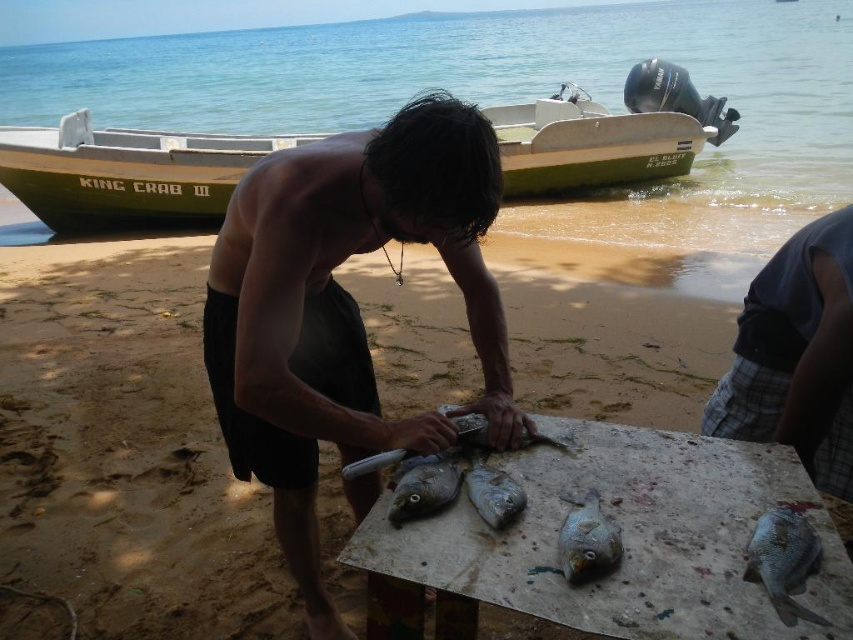
Question: Which point is closer to the camera?

Choices:
 (A) (416, 481)
 (B) (399, 330)
 (C) (654, 72)

Answer: (A)

Question: Can you confirm if gray plaid shorts at lower right is positioned below shiny silver fish at center?

Choices:
 (A) no
 (B) yes

Answer: (A)

Question: Among these objects, which one is nearest to the camera?

Choices:
 (A) gray matte fish at center
 (B) sandy beach at center
 (C) white worn wood table at center

Answer: (C)

Question: Which of these objects is positioned farthest from the white worn wood table at center?

Choices:
 (A) green matte boat at upper center
 (B) dark brown shorts at center
 (C) silvery metallic fish at center
 (D) shiny silver fish at lower right

Answer: (A)

Question: Is sandy beach at center above silvery metallic fish at center?

Choices:
 (A) no
 (B) yes

Answer: (A)

Question: Considering the relative positions of shiny silver fish at lower right and gray matte fish at center in the image provided, where is shiny silver fish at lower right located with respect to gray matte fish at center?

Choices:
 (A) left
 (B) right

Answer: (B)